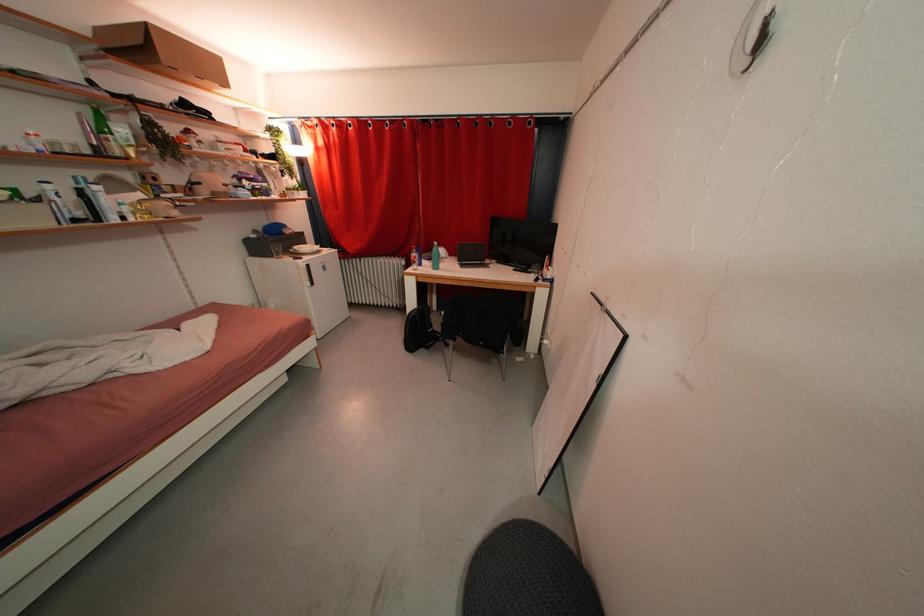
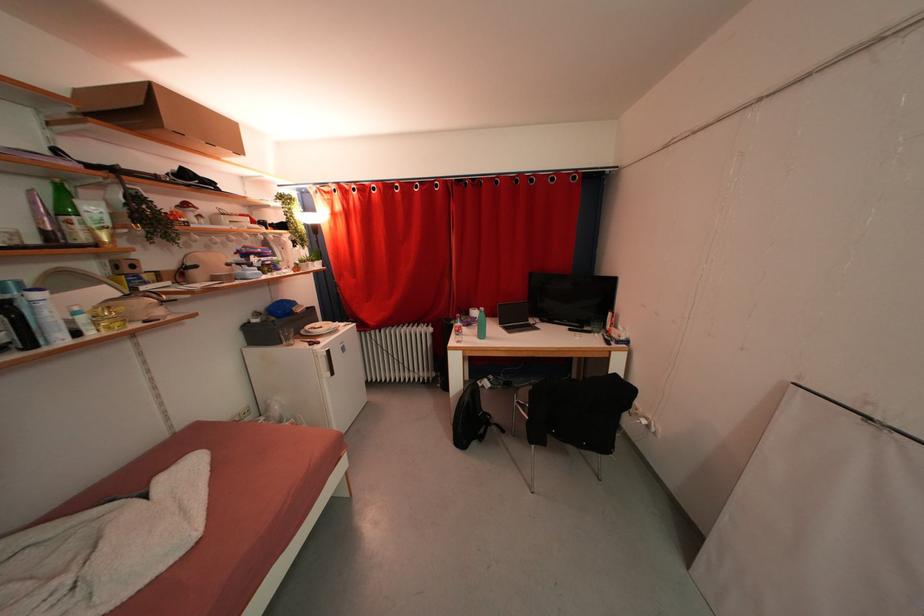
The images are taken continuously from a first-person perspective. In which direction are you moving?

The cameraman moved toward left, forward.